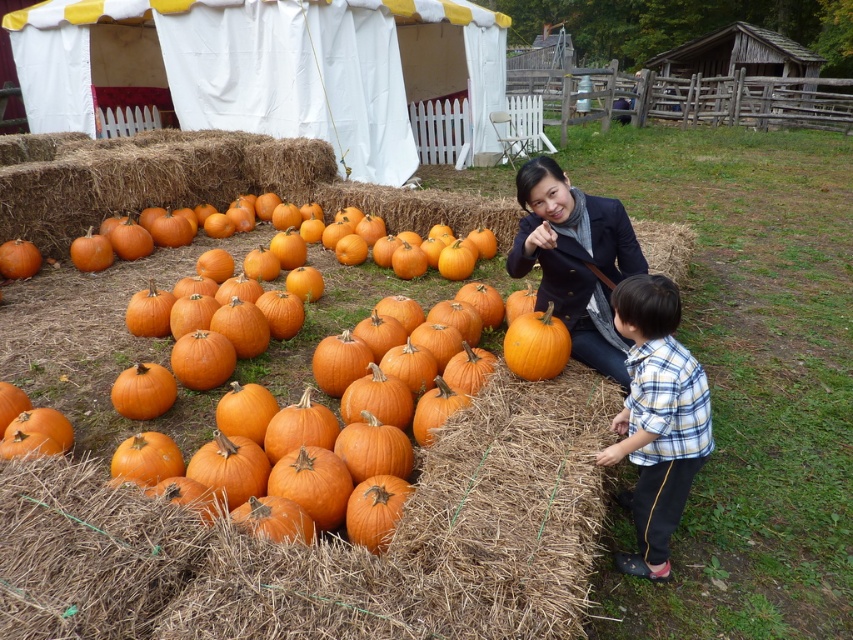
Which is more to the right, matte black coat at center or orange matte pumpkin at center?

matte black coat at center is more to the right.

Does matte black coat at center have a lesser width compared to orange matte pumpkin at center?

In fact, matte black coat at center might be wider than orange matte pumpkin at center.

Measure the distance between point (621, 269) and camera.

They are 3.17 meters apart.

The image size is (853, 640). Find the location of `matte black coat at center`. matte black coat at center is located at coordinates (575, 260).

Who is lower down, yellow plaid shirt at lower right or orange matte pumpkin at center?

yellow plaid shirt at lower right is lower down.

Can you confirm if yellow plaid shirt at lower right is positioned to the left of orange matte pumpkin at center?

Incorrect, yellow plaid shirt at lower right is not on the left side of orange matte pumpkin at center.

Find the location of a particular element. This screenshot has width=853, height=640. yellow plaid shirt at lower right is located at coordinates (657, 419).

Does matte black coat at center come behind orange matte pumpkin at left?

No, matte black coat at center is closer to the viewer.

The image size is (853, 640). I want to click on matte black coat at center, so click(x=575, y=260).

Locate an element on the screen. The height and width of the screenshot is (640, 853). matte black coat at center is located at coordinates (575, 260).